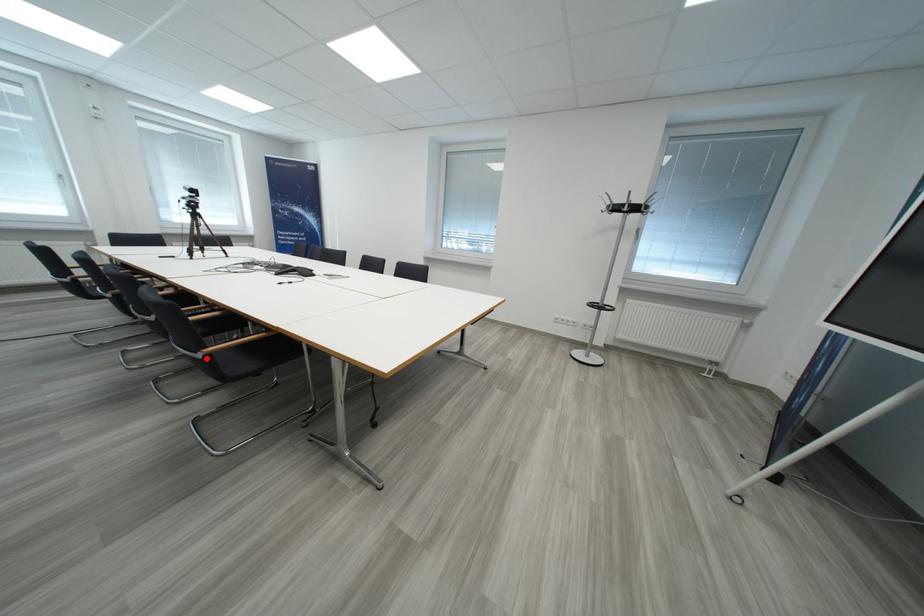
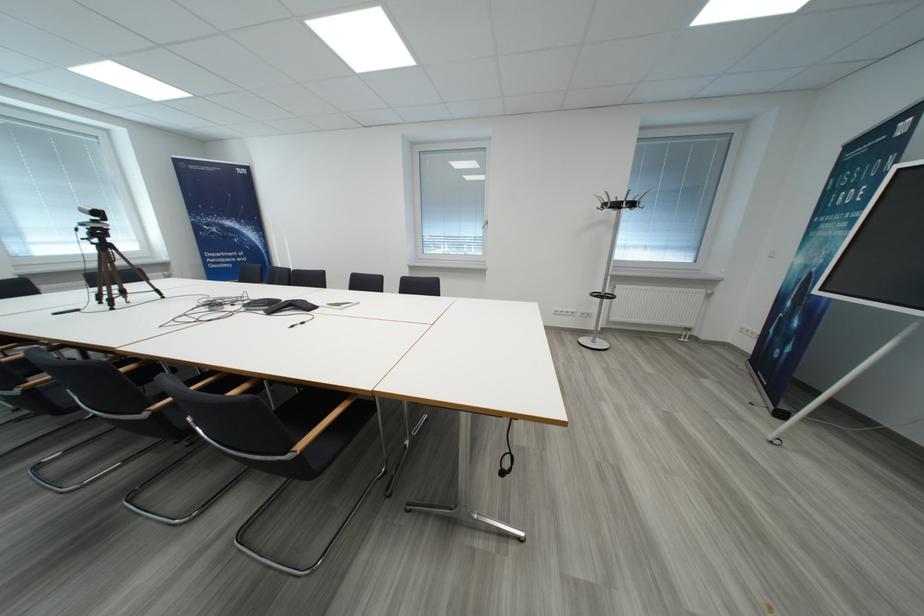
Locate, in the second image, the point that corresponds to the highlighted location in the first image.

(296, 460)